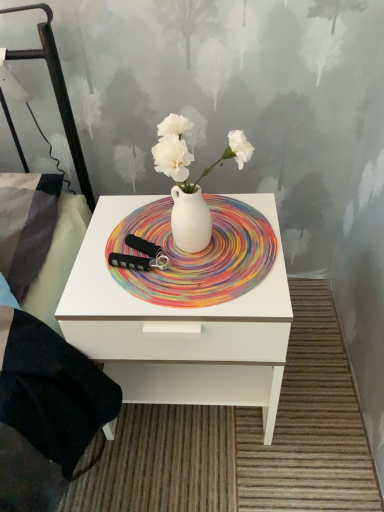
Question: From their relative heights in the image, would you say white glossy nightstand at center is taller or shorter than white matte plate at center?

Choices:
 (A) tall
 (B) short

Answer: (A)

Question: Considering the positions of white glossy nightstand at center and white matte plate at center in the image, is white glossy nightstand at center bigger or smaller than white matte plate at center?

Choices:
 (A) big
 (B) small

Answer: (A)

Question: Which object is the closest to the white matte vase at center?

Choices:
 (A) white glossy nightstand at center
 (B) white matte plate at center

Answer: (B)

Question: Which object is the closest to the white matte vase at center?

Choices:
 (A) white matte plate at center
 (B) white glossy nightstand at center

Answer: (A)